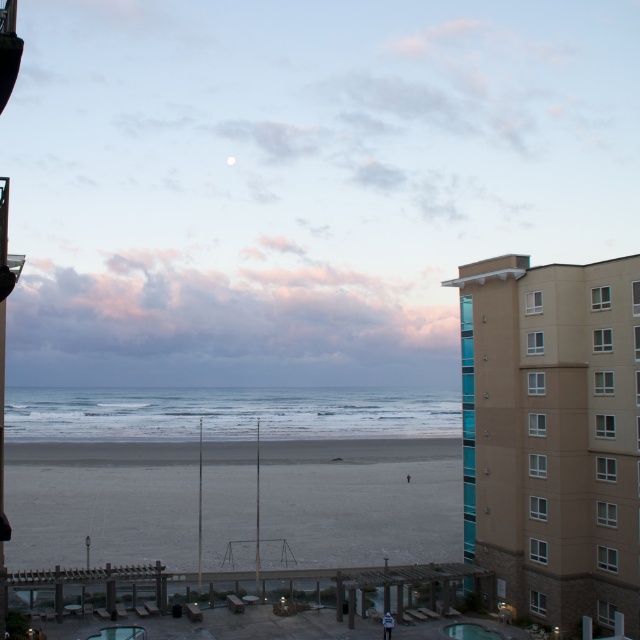
Is point (584, 580) closer to viewer compared to point (129, 627)?

Yes, point (584, 580) is closer to viewer.

Which of these two, beige concrete building at right or transparent glass pool at lower center, stands shorter?

Standing shorter between the two is transparent glass pool at lower center.

Image resolution: width=640 pixels, height=640 pixels. What are the coordinates of `beige concrete building at right` in the screenshot? It's located at (552, 435).

Is matte blue sky at upper center smaller than beige concrete building at right?

Incorrect, matte blue sky at upper center is not smaller in size than beige concrete building at right.

Can you confirm if matte blue sky at upper center is positioned above beige concrete building at right?

Yes, matte blue sky at upper center is above beige concrete building at right.

Who is more distant from viewer, (81, 376) or (484, 540)?

The point (81, 376) is more distant.

I want to click on matte blue sky at upper center, so click(300, 179).

Can you confirm if beige concrete building at right is positioned below smooth concrete pool at center?

Actually, beige concrete building at right is above smooth concrete pool at center.

Is beige concrete building at right positioned before smooth concrete pool at center?

That is True.

Measure the distance between point (468, 326) and camera.

Point (468, 326) is 46.03 meters away from camera.

Find the location of a particular element. The width and height of the screenshot is (640, 640). beige concrete building at right is located at coordinates (552, 435).